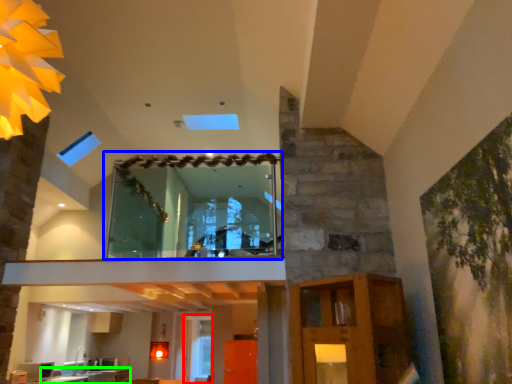
Question: Considering the real-world distances, which object is closest to glass door (highlighted by a red box)? window (highlighted by a blue box) or counter top (highlighted by a green box).

Choices:
 (A) window
 (B) counter top

Answer: (B)